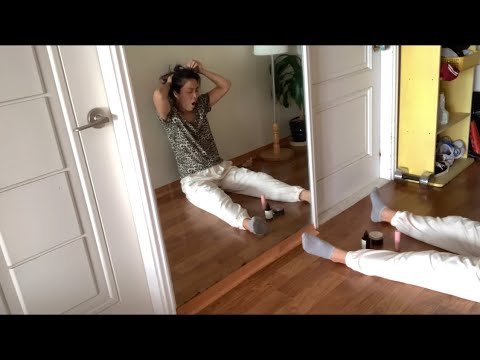
I want to click on shelf, so click(424, 93).